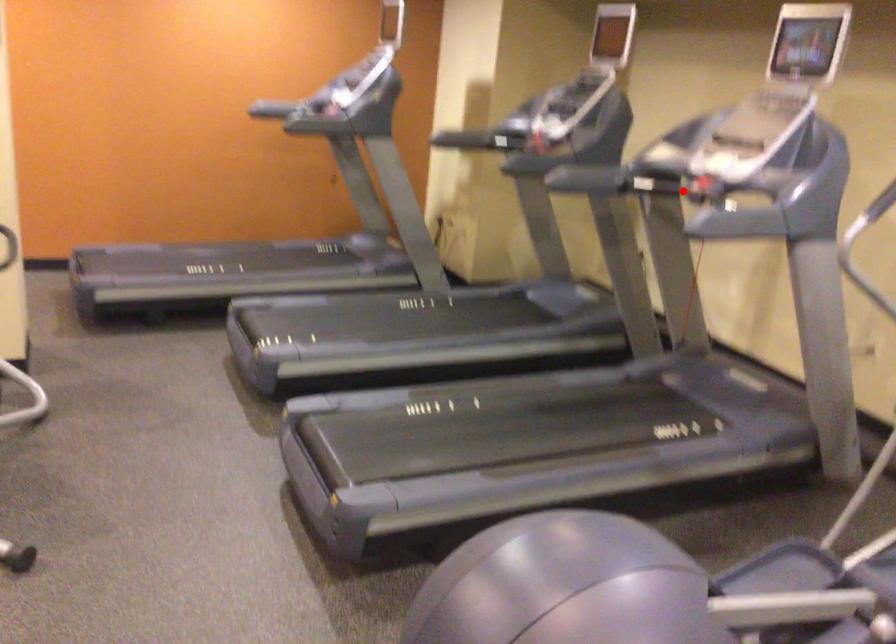
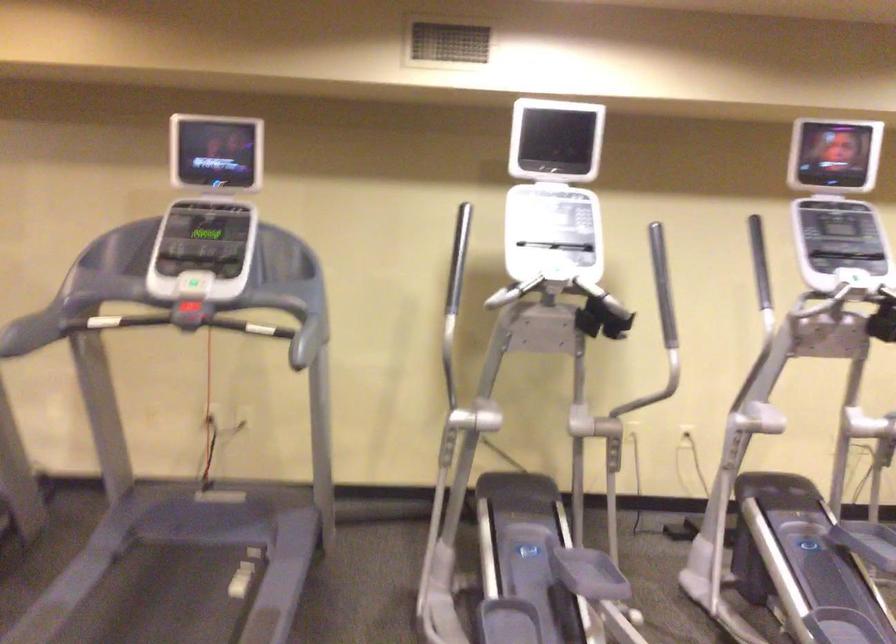
Locate, in the second image, the point that corresponds to the highlighted location in the first image.

(187, 321)